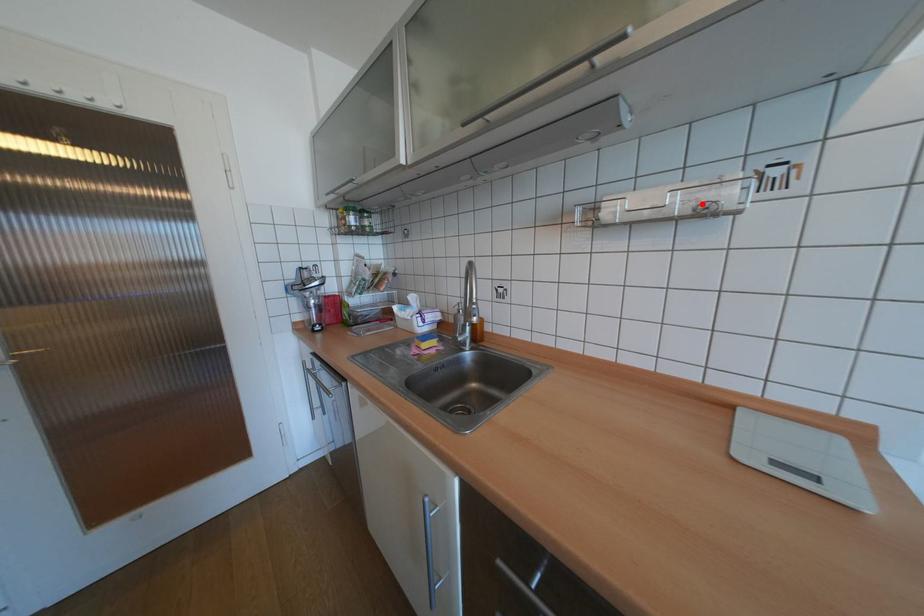
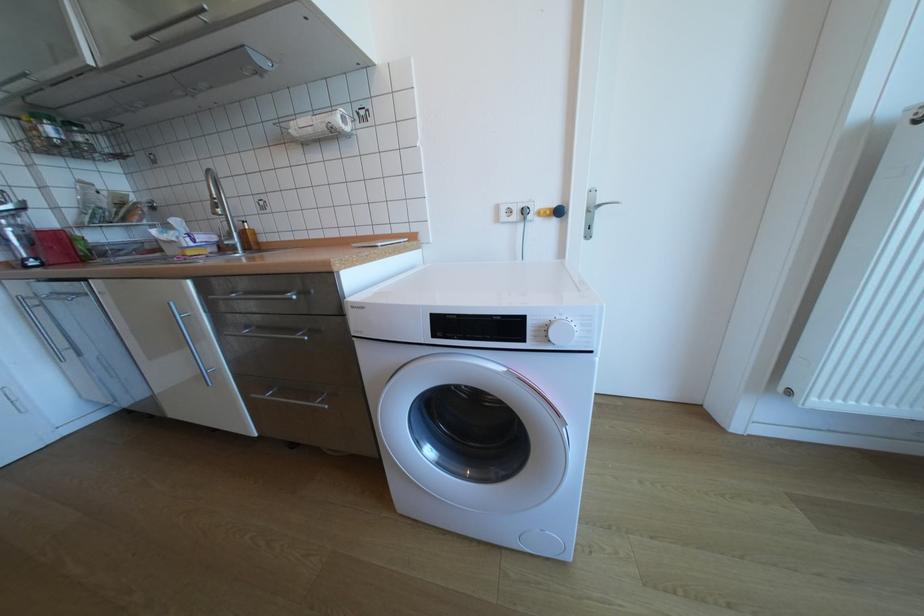
Where in the second image is the point corresponding to the highlighted location from the first image?

(334, 124)